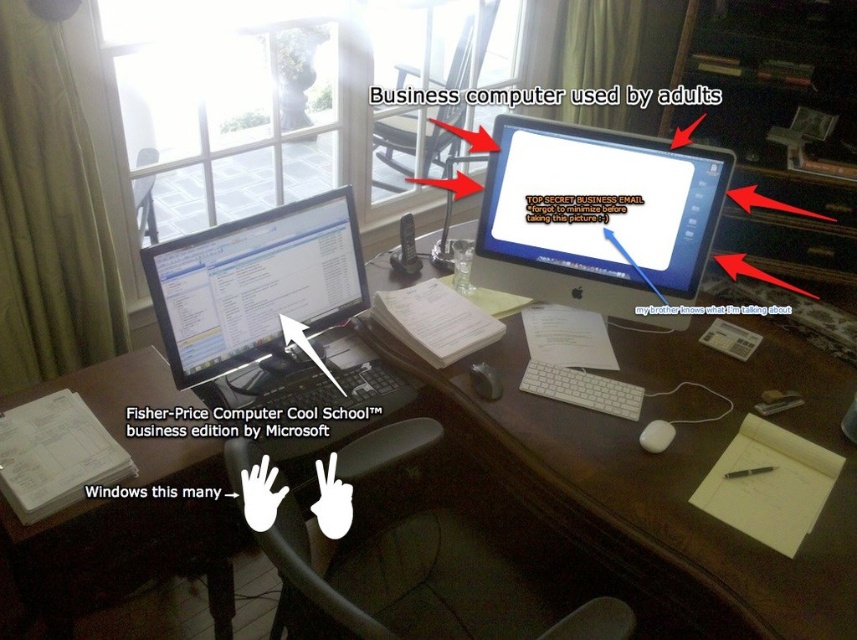
You are standing in front of the desk and want to reach the point at coordinates point (229, 289). If your arm can extend 3 feet, can you reach it?

The distance of point (229, 289) from viewer is 4.39 feet, so no, your arm cannot reach it since it is further away than 3 feet.

You are sitting at the desk in the image and need to reach both the point at coordinates point (x=531, y=442) and the point at coordinates point (x=667, y=426). Which point should you reach for first if you want to follow the order from closest to farthest?

You should reach for point (x=531, y=442) first because it is closer to you than point (x=667, y=426), which is further away.

You have a 10 cm wide paperweight that you want to place on the brown wooden desk at center. The white matte mouse at center is currently occupying some space. Can the paperweight fit on the desk without overlapping the mouse?

The brown wooden desk at center might be wider than white matte mouse at center, so there is a possibility that the paperweight can fit without overlapping, but it depends on the exact dimensions and arrangement of both items.